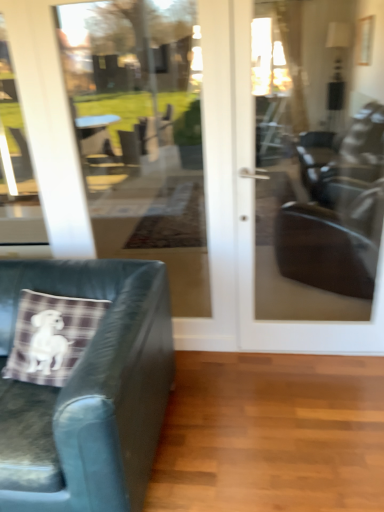
I want to click on vacant space in front of matte glass door at center, so click(x=308, y=406).